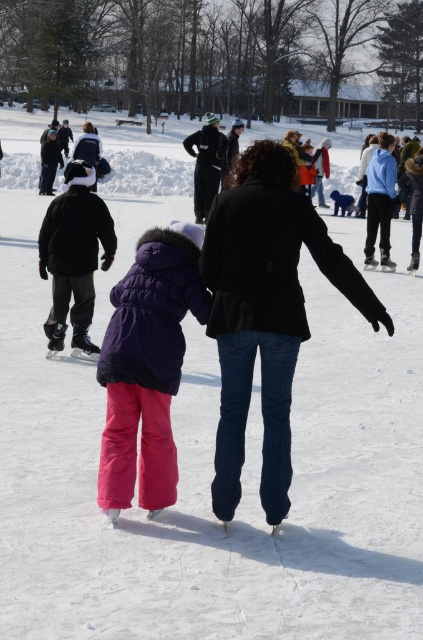
In the scene shown: You are standing at the center of the ice rink and notice a black matte coat at center. What is located at the point with coordinates (266,312)?

The black matte coat at center is located at point (266,312).

You are a photographer trying to capture a group photo of the two people in the center. Since you want to ensure both the black matte coat at center and the matte purple jacket at center are clearly visible in the frame, which person should you position closer to the camera to avoid any overlap?

The black matte coat at center has a larger width than the matte purple jacket at center, so positioning the person in the matte purple jacket at center closer to the camera would help prevent overlap and ensure both are clearly visible.